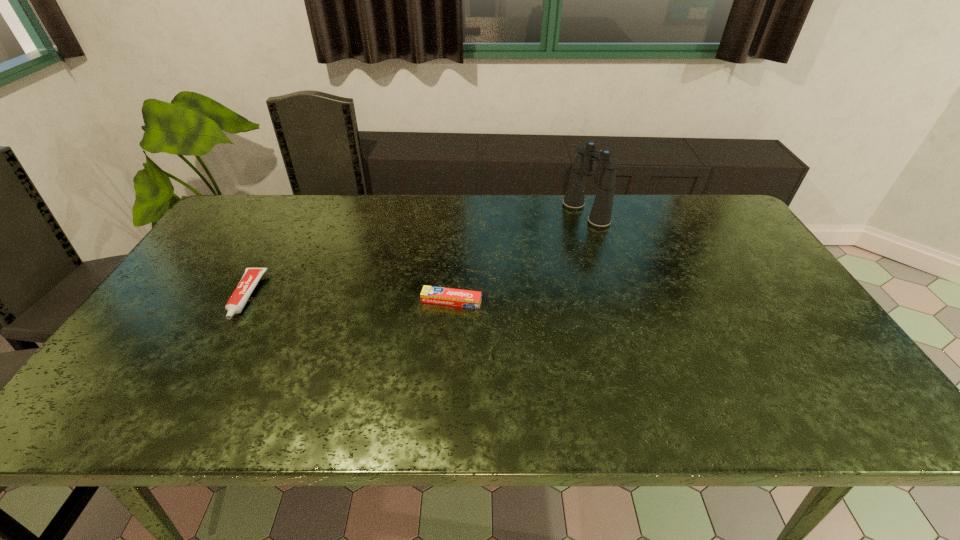
In order to click on vacant space at the far edge in this screenshot , I will do `click(626, 226)`.

I want to click on vacant space at the near edge, so click(740, 399).

You are a GUI agent. You are given a task and a screenshot of the screen. Output one action in this format:
    pyautogui.click(x=<x>, y=<y>)
    Task: Click on the vacant area at the right edge of the desktop
    The image size is (960, 540).
    Given the screenshot: What is the action you would take?
    pyautogui.click(x=771, y=318)

Find the location of a particular element. Image resolution: width=960 pixels, height=540 pixels. free location at the near left corner is located at coordinates (161, 406).

Find the location of `free point between the tallest object and the right toothpaste`. free point between the tallest object and the right toothpaste is located at coordinates (518, 257).

Locate an element on the screen. Image resolution: width=960 pixels, height=540 pixels. free space between the rightmost object and the second object from right to left is located at coordinates (518, 257).

This screenshot has width=960, height=540. I want to click on free space between the right toothpaste and the rightmost object, so [x=518, y=257].

Identify the location of empty space between the farthest object and the second tallest object. (416, 255).

The image size is (960, 540). I want to click on free spot between the left toothpaste and the shortest object, so click(348, 299).

The height and width of the screenshot is (540, 960). Find the location of `vacant point located between the shortest object and the binoculars`. vacant point located between the shortest object and the binoculars is located at coordinates (518, 257).